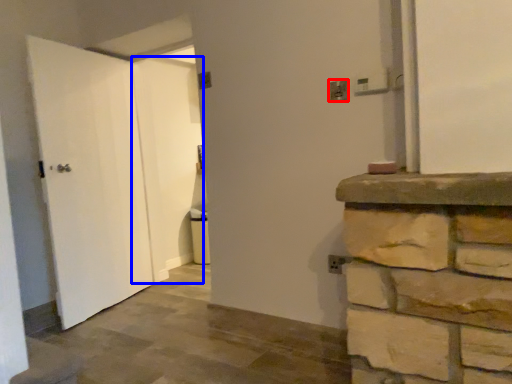
Question: Which point is further to the camera, electric outlet (highlighted by a red box) or door (highlighted by a blue box)?

Choices:
 (A) electric outlet
 (B) door

Answer: (B)